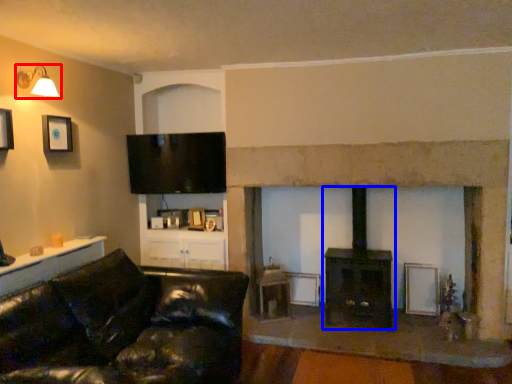
Question: Which of the following is the farthest to the observer, lamp (highlighted by a red box) or wood burning stove (highlighted by a blue box)?

Choices:
 (A) lamp
 (B) wood burning stove

Answer: (B)